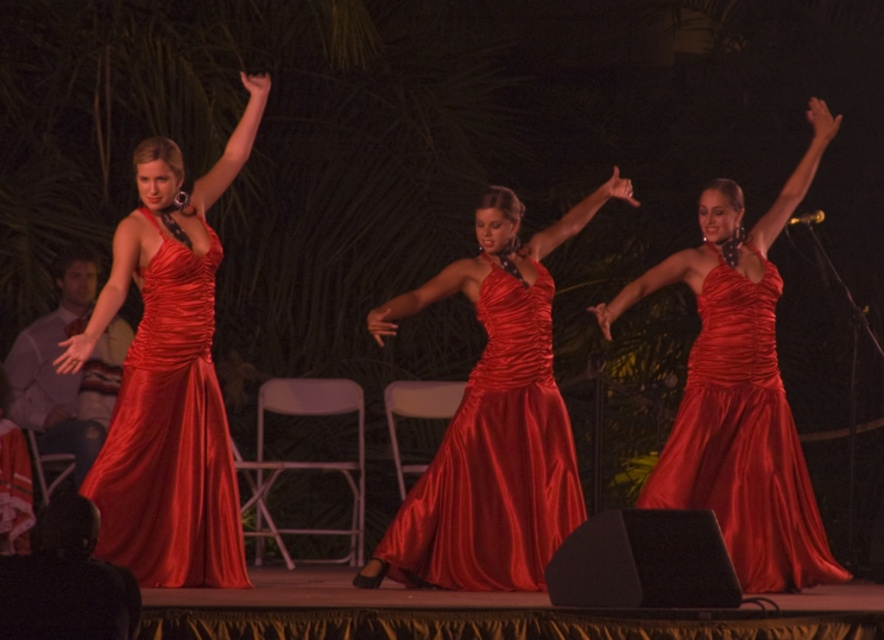
You are a photographer trying to capture the dancers in this image. You want to ensure that both the satin dress at center and the satin dress at left are fully visible in your shot. Based on their widths, which dress requires a wider framing to avoid being cut off?

The satin dress at center requires a wider framing because it is wider than the satin dress at left.

You are a photographer at the back of the stage. You want to capture a photo where both the satin dress at center and the satin dress at left are clearly visible. Which dress should you adjust your camera focus to prioritize to ensure both are in frame?

The satin dress at center is located below the satin dress at left. To ensure both are in frame, prioritize focusing on the satin dress at left first, as it is higher up, allowing the camera to capture the lower positioned satin dress at center in the same shot.

You are a photographer at the back of the stage. You want to take a photo that includes both the satin dress at center and the satin dress at left. Which dress should you zoom in on to ensure both are in frame without cropping?

The satin dress at center is larger than the satin dress at left. To include both in frame without cropping, you should zoom out slightly to accommodate the larger size of the satin dress at center.